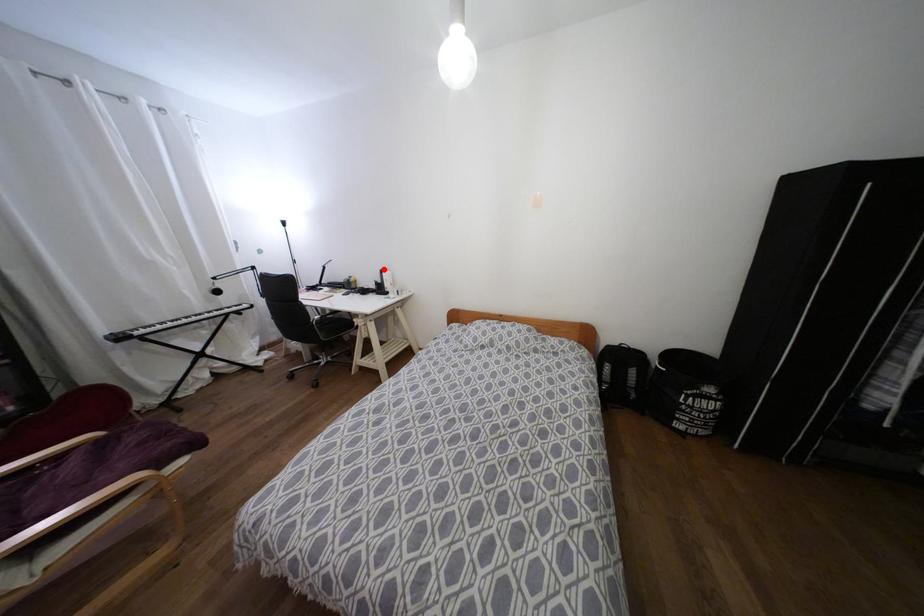
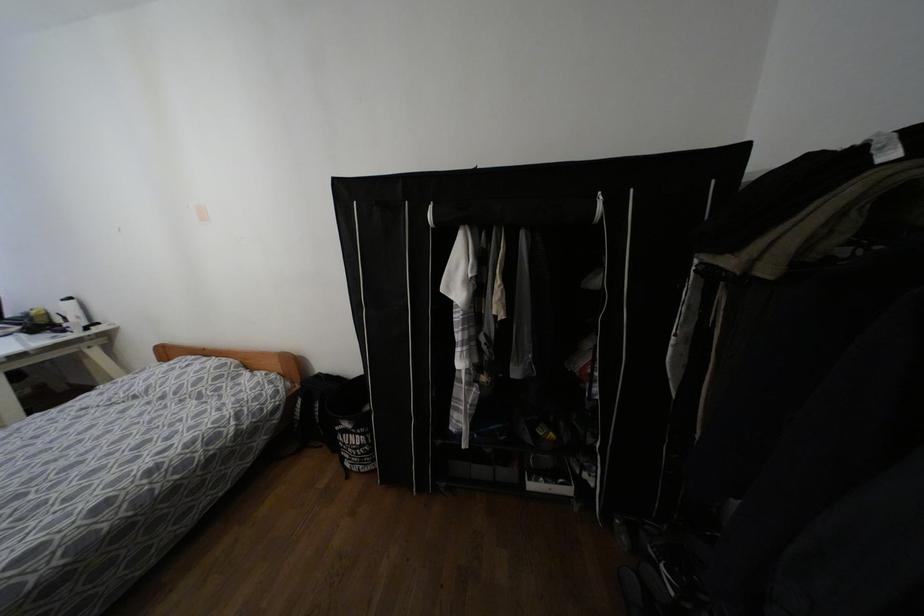
Question: I am providing you with two images of the same scene from different viewpoints. Given a red point in image1, look at the same physical point in image2. Is it:

Choices:
 (A) Closer to the viewpoint
 (B) Farther from the viewpoint

Answer: (B)